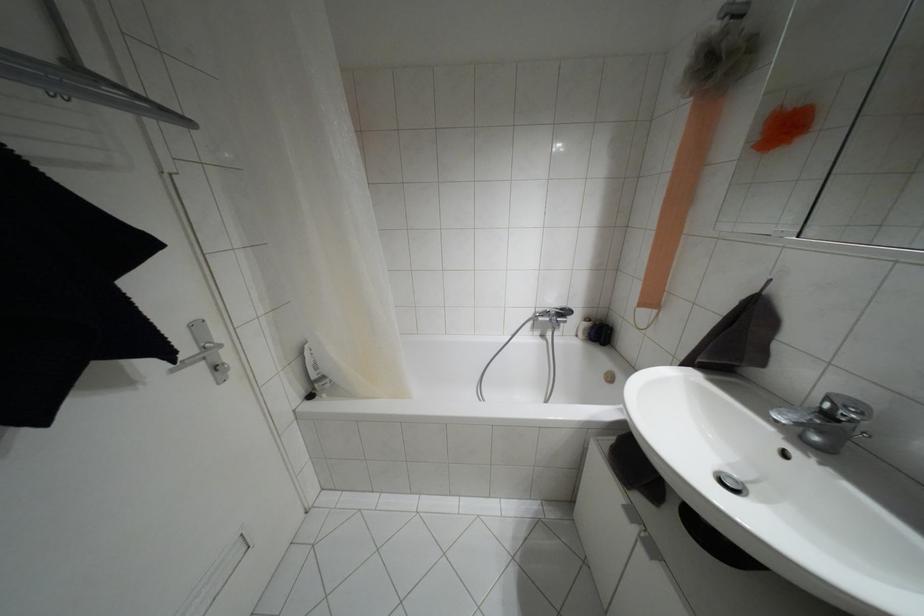
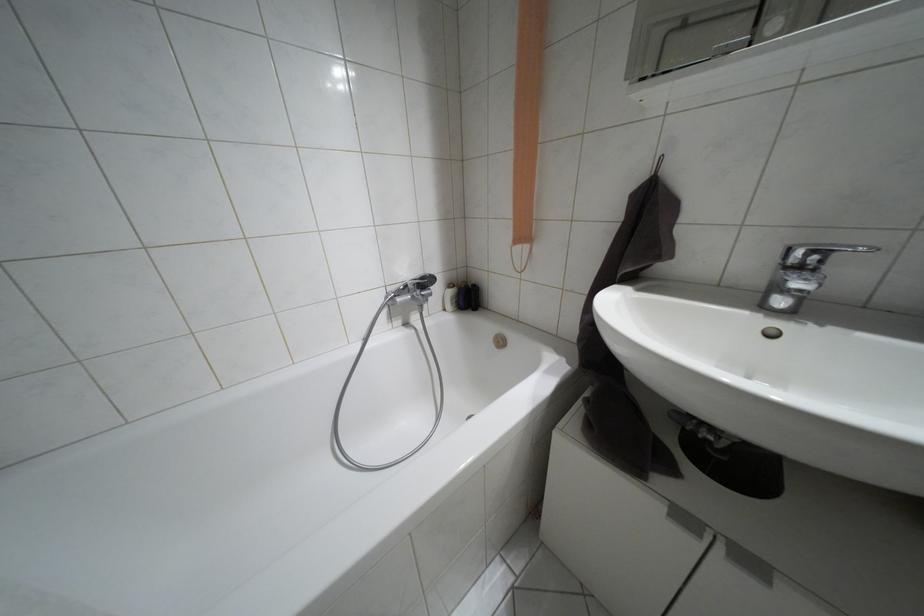
Question: The first image is from the beginning of the video and the second image is from the end. How did the camera likely rotate when shooting the video?

Choices:
 (A) Left
 (B) Right
 (C) Up
 (D) Down

Answer: (B)